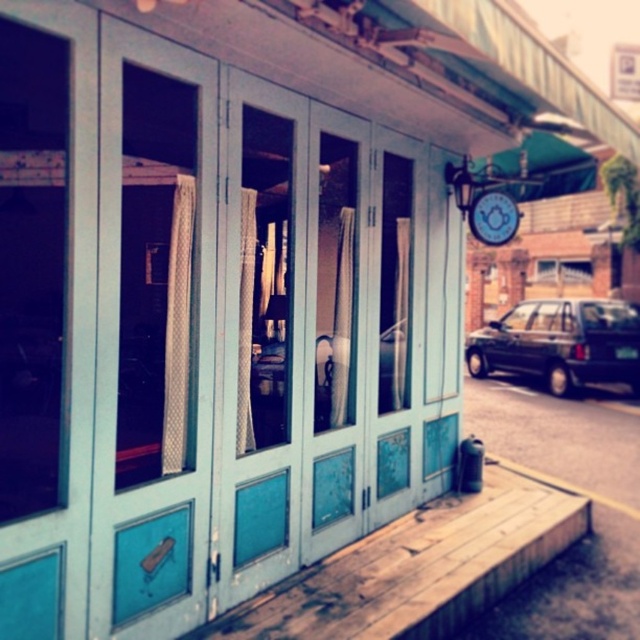
Question: Considering the real-world distances, which object is closest to the dark green matte van at right?

Choices:
 (A) transparent glass door at left
 (B) translucent glass screen door at left

Answer: (B)

Question: Does dark green matte van at right lie in front of matte blue clock at upper center?

Choices:
 (A) no
 (B) yes

Answer: (A)

Question: Considering the relative positions of transparent glass door at left and matte blue clock at upper center in the image provided, where is transparent glass door at left located with respect to matte blue clock at upper center?

Choices:
 (A) below
 (B) above

Answer: (A)

Question: Among these points, which one is farthest from the camera?

Choices:
 (A) (577, 312)
 (B) (148, 204)
 (C) (486, 205)

Answer: (A)

Question: Which of the following is the closest to the observer?

Choices:
 (A) (516, 355)
 (B) (35, 454)
 (C) (115, 160)

Answer: (C)

Question: Considering the relative positions of transparent glass door at left and dark green matte van at right in the image provided, where is transparent glass door at left located with respect to dark green matte van at right?

Choices:
 (A) left
 (B) right

Answer: (A)